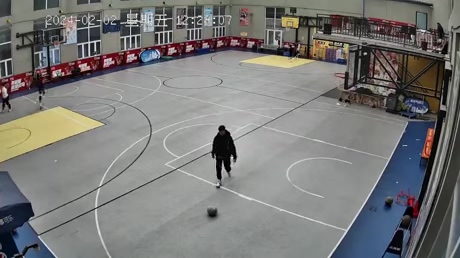
You are a GUI agent. You are given a task and a screenshot of the screen. Output one action in this format:
    pyautogui.click(x=<x>, y=<y>)
    Task: Click on the window
    The height and width of the screenshot is (258, 460).
    Given the screenshot: What is the action you would take?
    pyautogui.click(x=85, y=33)